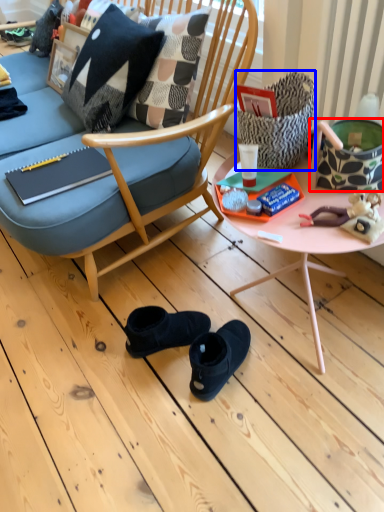
Question: Which point is further to the camera, handbag (highlighted by a red box) or handbag (highlighted by a blue box)?

Choices:
 (A) handbag
 (B) handbag

Answer: (B)